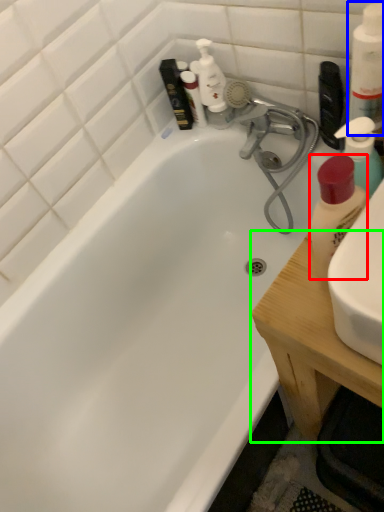
Question: Considering the real-world distances, which object is closest to cleaning product (highlighted by a red box)? cleaning product (highlighted by a blue box) or counter top (highlighted by a green box).

Choices:
 (A) cleaning product
 (B) counter top

Answer: (A)